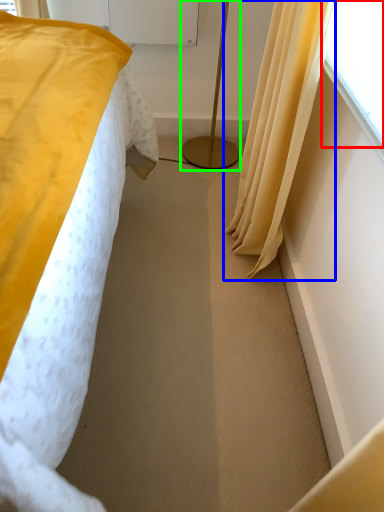
Question: Which object is positioned closest to window screen (highlighted by a red box)? Select from curtain (highlighted by a blue box) and bedside lamp (highlighted by a green box).

Choices:
 (A) curtain
 (B) bedside lamp

Answer: (A)